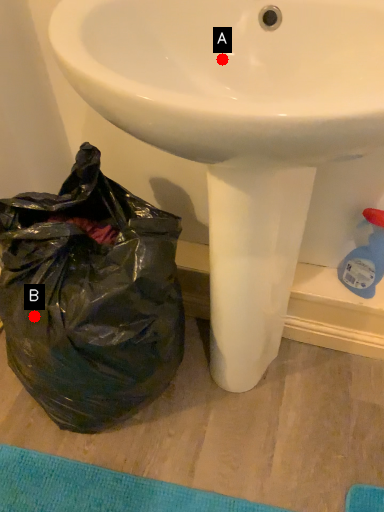
Question: Two points are circled on the image, labeled by A and B beside each circle. Which point appears farthest from the camera in this image?

Choices:
 (A) A is further
 (B) B is further

Answer: (B)